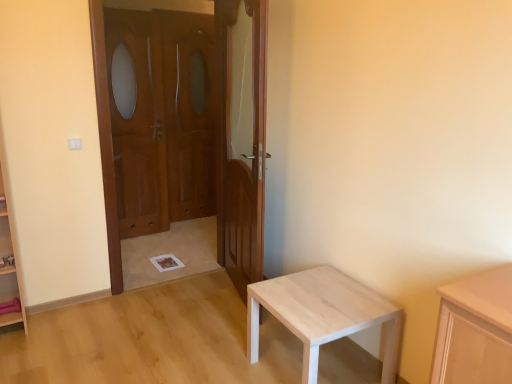
This screenshot has width=512, height=384. I want to click on vacant space in front of wooden screen door at center, the 1th screen door in the left-to-right sequence, so click(144, 245).